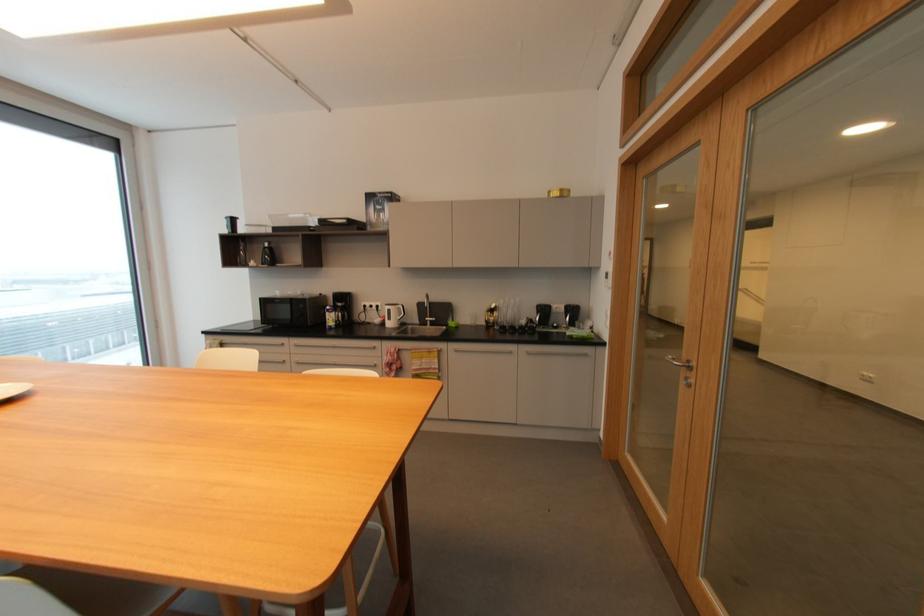
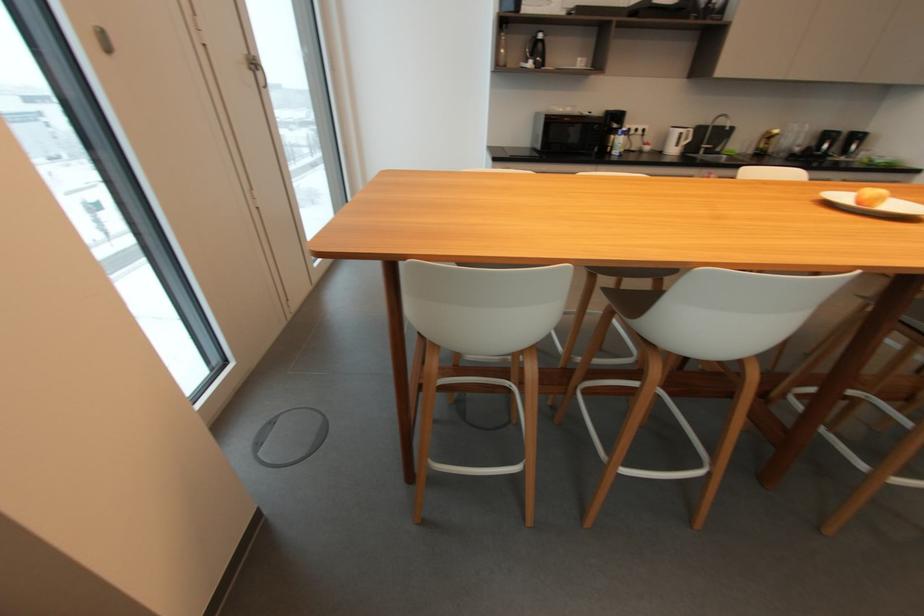
In the second image, find the point that corresponds to point 393,310 in the first image.

(685, 134)